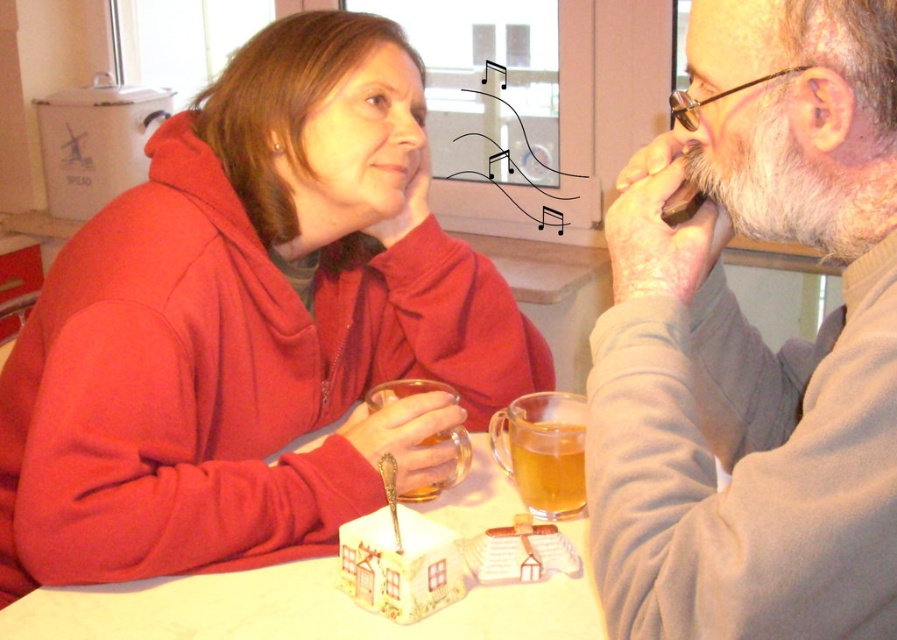
Is point (188, 499) closer to camera compared to point (550, 513)?

Yes, it is.

Which is in front, point (48, 285) or point (533, 512)?

Point (533, 512)

Is point (236, 566) closer to camera compared to point (567, 468)?

Yes, it is in front of point (567, 468).

At what (x,y) coordinates should I click in order to perform the action: click on matte red hoodie at center. Please return your answer as a coordinate pair (x, y). The height and width of the screenshot is (640, 897). Looking at the image, I should click on (251, 326).

Which is more to the left, matte red hoodie at center or white glossy table at center?

From the viewer's perspective, matte red hoodie at center appears more on the left side.

Is point (162, 321) farther from camera compared to point (90, 605)?

That is True.

Where is `matte red hoodie at center`? Image resolution: width=897 pixels, height=640 pixels. matte red hoodie at center is located at coordinates (251, 326).

Is gray matte sweater at right to the right of white glossy table at center from the viewer's perspective?

Yes, gray matte sweater at right is to the right of white glossy table at center.

Which is below, gray matte sweater at right or white glossy table at center?

white glossy table at center

Measure the distance between point (703,241) and camera.

Point (703,241) and camera are 30.02 inches apart from each other.

Find the location of a particular element. gray matte sweater at right is located at coordinates (753, 342).